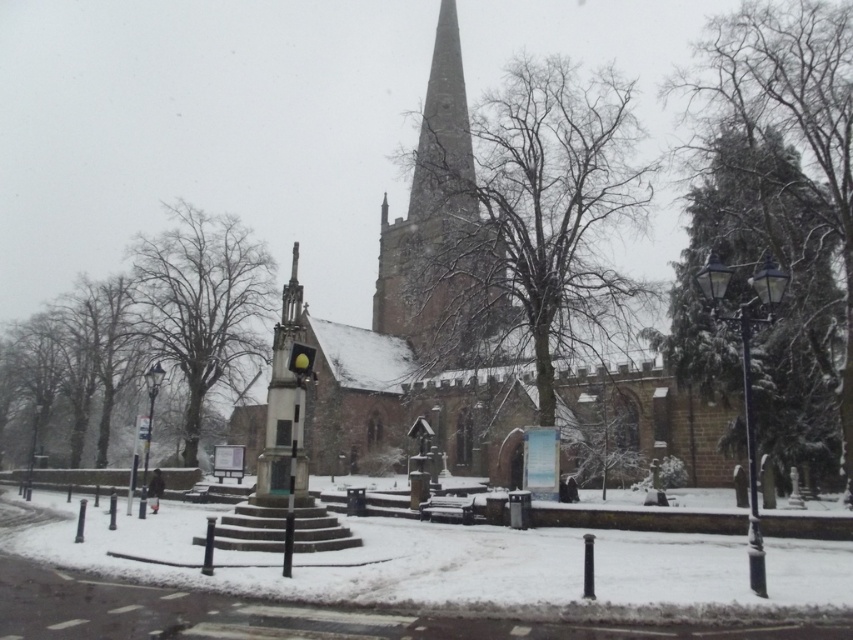
Who is positioned more to the right, brown stone church at center or smooth stone spire at center?

From the viewer's perspective, smooth stone spire at center appears more on the right side.

Is brown stone church at center positioned before smooth stone spire at center?

Yes, it is.

Who is more distant from viewer, (436,161) or (405,252)?

Point (405,252)

Locate an element on the screen. This screenshot has width=853, height=640. brown stone church at center is located at coordinates (409, 310).